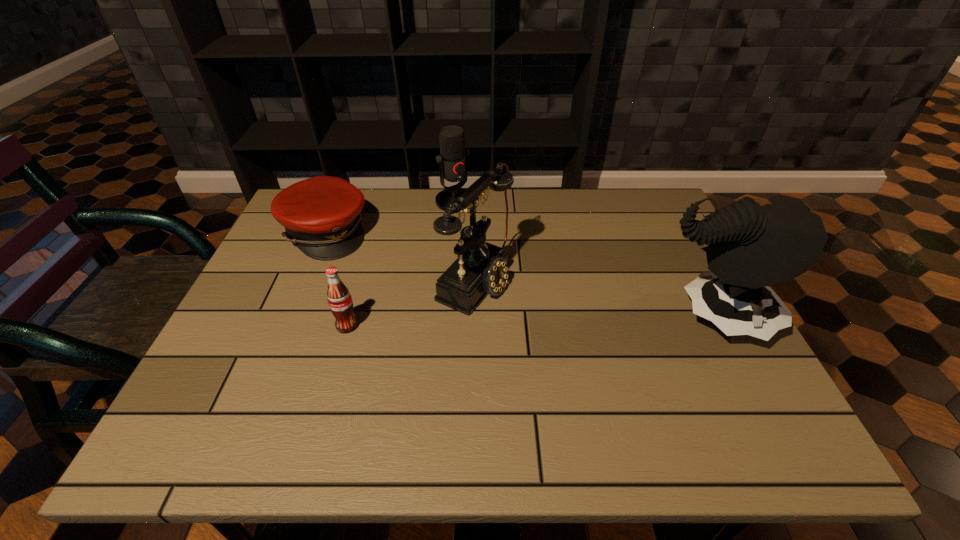
You are a GUI agent. You are given a task and a screenshot of the screen. Output one action in this format:
    pyautogui.click(x=<x>, y=<y>)
    Task: Click on the soda
    The image size is (960, 540).
    Given the screenshot: What is the action you would take?
    pyautogui.click(x=340, y=302)

Image resolution: width=960 pixels, height=540 pixels. I want to click on doll, so click(x=750, y=247).

The width and height of the screenshot is (960, 540). Find the location of `the third tallest object`. the third tallest object is located at coordinates pyautogui.click(x=452, y=160).

The height and width of the screenshot is (540, 960). Identify the location of cap. (321, 215).

I want to click on the second tallest object, so click(x=481, y=268).

Where is `free region located 0.390m on the right of the soda`? free region located 0.390m on the right of the soda is located at coordinates (527, 326).

Where is `vacant space positioned 0.270m on the side of the third shortest object with the red ring`? The width and height of the screenshot is (960, 540). vacant space positioned 0.270m on the side of the third shortest object with the red ring is located at coordinates (515, 261).

The height and width of the screenshot is (540, 960). In order to click on free region located 0.130m on the side of the third shortest object with the red ring in this screenshot , I will do pos(487,233).

The width and height of the screenshot is (960, 540). In order to click on blank area located on the side of the third shortest object with the red ring in this screenshot , I will do `click(494, 241)`.

You are a GUI agent. You are given a task and a screenshot of the screen. Output one action in this format:
    pyautogui.click(x=<x>, y=<y>)
    Task: Click on the vacant point located 0.130m on the front of the shortest object with an emblem
    This screenshot has width=960, height=540.
    Given the screenshot: What is the action you would take?
    pyautogui.click(x=388, y=268)